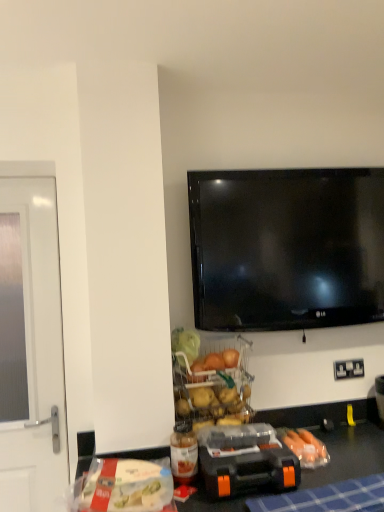
Question: Is white plastic bag at lower left wider than translucent plastic bottle at lower center?

Choices:
 (A) yes
 (B) no

Answer: (A)

Question: Does white plastic bag at lower left have a larger size compared to translucent plastic bottle at lower center?

Choices:
 (A) yes
 (B) no

Answer: (A)

Question: From the image's perspective, is white plastic bag at lower left over translucent plastic bottle at lower center?

Choices:
 (A) no
 (B) yes

Answer: (A)

Question: From a real-world perspective, does white plastic bag at lower left stand above translucent plastic bottle at lower center?

Choices:
 (A) yes
 (B) no

Answer: (B)

Question: Can you confirm if white plastic bag at lower left is thinner than translucent plastic bottle at lower center?

Choices:
 (A) no
 (B) yes

Answer: (A)

Question: In the image, is translucent plastic bottle at lower center positioned in front of or behind white plastic electric outlet at lower right?

Choices:
 (A) behind
 (B) front

Answer: (B)

Question: Is translucent plastic bottle at lower center situated inside white plastic electric outlet at lower right or outside?

Choices:
 (A) inside
 (B) outside

Answer: (B)

Question: From their relative heights in the image, would you say translucent plastic bottle at lower center is taller or shorter than white plastic electric outlet at lower right?

Choices:
 (A) short
 (B) tall

Answer: (B)

Question: From a real-world perspective, is translucent plastic bottle at lower center physically located above or below white plastic electric outlet at lower right?

Choices:
 (A) below
 (B) above

Answer: (A)

Question: From the image's perspective, relative to clear glass screen door at left, is black plastic toolbox at lower center above or below?

Choices:
 (A) above
 (B) below

Answer: (B)

Question: Considering the relative positions of black plastic toolbox at lower center and clear glass screen door at left in the image provided, is black plastic toolbox at lower center to the left or to the right of clear glass screen door at left?

Choices:
 (A) right
 (B) left

Answer: (A)

Question: In terms of height, does black plastic toolbox at lower center look taller or shorter compared to clear glass screen door at left?

Choices:
 (A) tall
 (B) short

Answer: (B)

Question: Considering their positions, is black plastic toolbox at lower center located in front of or behind clear glass screen door at left?

Choices:
 (A) front
 (B) behind

Answer: (A)

Question: Is point click(x=31, y=205) closer or farther from the camera than point click(x=180, y=463)?

Choices:
 (A) closer
 (B) farther

Answer: (B)

Question: Based on their sizes in the image, would you say clear glass screen door at left is bigger or smaller than translucent plastic bottle at lower center?

Choices:
 (A) big
 (B) small

Answer: (A)